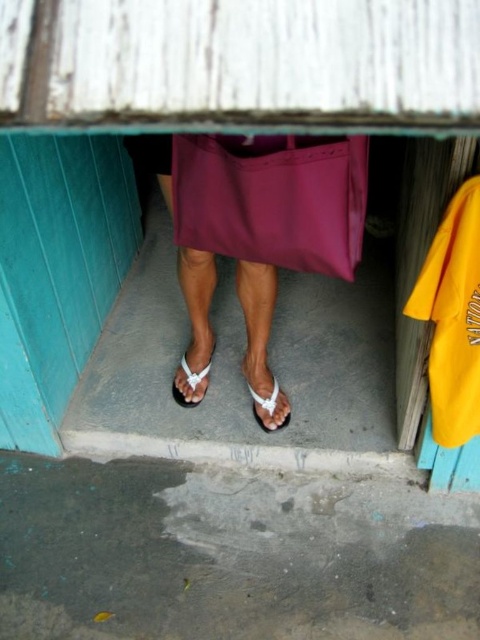
Is white plastic sandals at center shorter than matte purple dress at center?

In fact, white plastic sandals at center may be taller than matte purple dress at center.

Which is behind, point (310, 246) or point (219, 252)?

Positioned behind is point (219, 252).

This screenshot has height=640, width=480. Find the location of `white plastic sandals at center`. white plastic sandals at center is located at coordinates (261, 236).

Who is lower down, matte purple dress at center or white fabric sandal at center?

white fabric sandal at center

Is matte purple dress at center further to the viewer compared to white fabric sandal at center?

No, matte purple dress at center is closer to the viewer.

Which is in front, point (240, 259) or point (264, 410)?

Point (240, 259) is more forward.

This screenshot has height=640, width=480. Identify the location of matte purple dress at center. (273, 198).

Who is positioned more to the left, white plastic sandals at center or white matte sandal at center?

From the viewer's perspective, white matte sandal at center appears more on the left side.

Does white plastic sandals at center come in front of white matte sandal at center?

Yes, it is.

Is point (211, 332) farther from camera compared to point (195, 403)?

Yes, point (211, 332) is behind point (195, 403).

Where is `white plastic sandals at center`? The width and height of the screenshot is (480, 640). white plastic sandals at center is located at coordinates (261, 236).